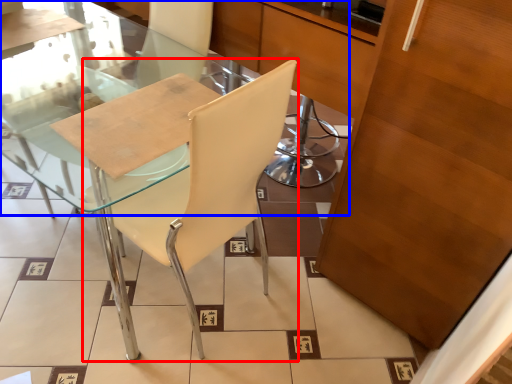
Question: Which object appears closest to the camera in this image, chair (highlighted by a red box) or glass table (highlighted by a blue box)?

Choices:
 (A) chair
 (B) glass table

Answer: (A)